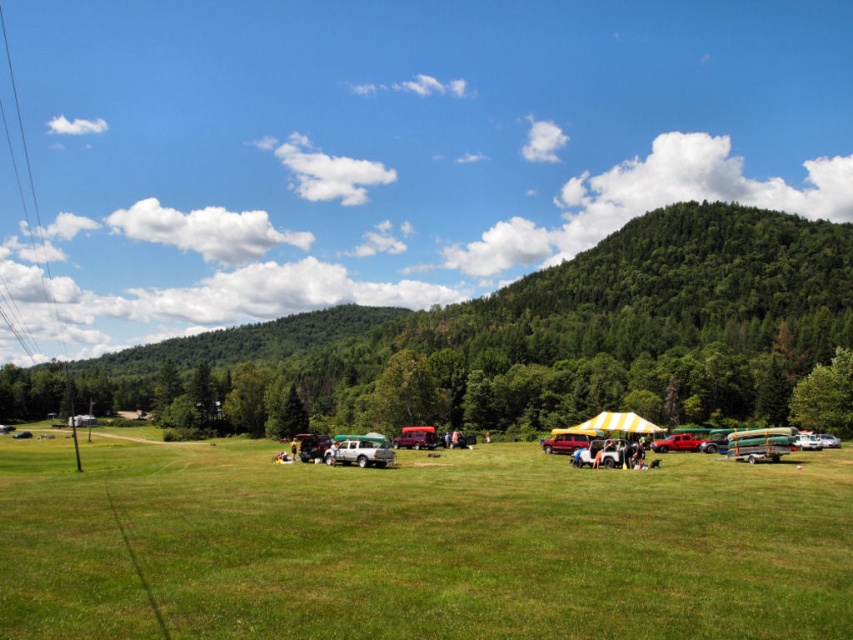
Question: Is green forested hill at center below silver metallic truck at center?

Choices:
 (A) no
 (B) yes

Answer: (A)

Question: Is green grassy field at center to the right of green forested hill at center from the viewer's perspective?

Choices:
 (A) no
 (B) yes

Answer: (B)

Question: Which object is closer to the camera taking this photo?

Choices:
 (A) green forested hill at center
 (B) green grassy field at center

Answer: (B)

Question: Which of the following is the closest to the observer?

Choices:
 (A) (350, 442)
 (B) (440, 465)

Answer: (A)

Question: Can you confirm if green forested hill at center is positioned to the right of silver metallic truck at center?

Choices:
 (A) yes
 (B) no

Answer: (B)

Question: Which point is farther to the camera?

Choices:
 (A) (540, 353)
 (B) (392, 456)
 (C) (341, 577)

Answer: (A)